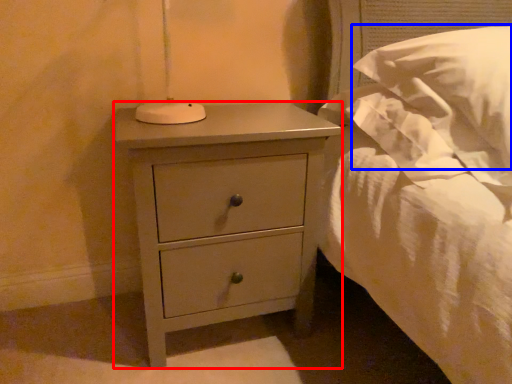
Question: Which of the following is the farthest to the observer, nightstand (highlighted by a red box) or pillow (highlighted by a blue box)?

Choices:
 (A) nightstand
 (B) pillow

Answer: (A)